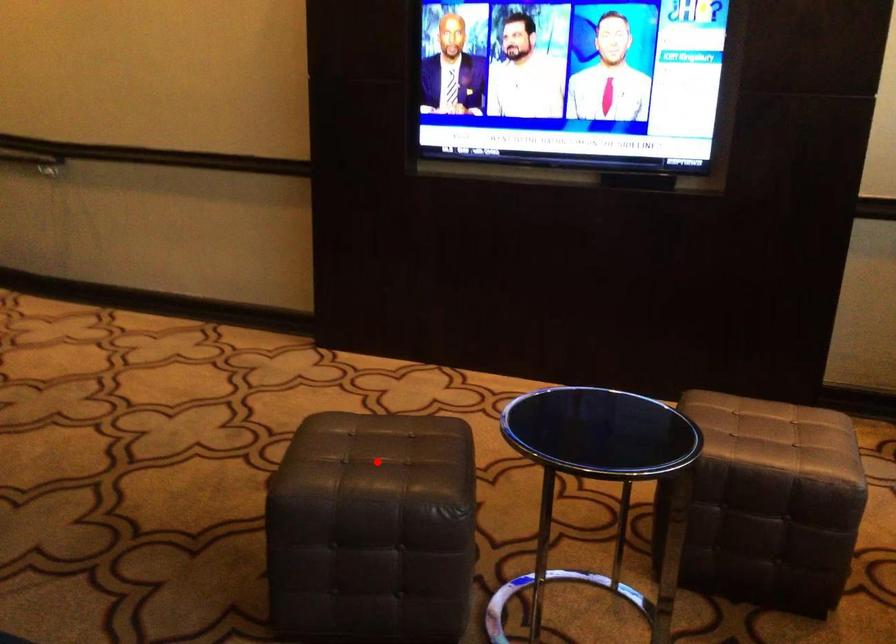
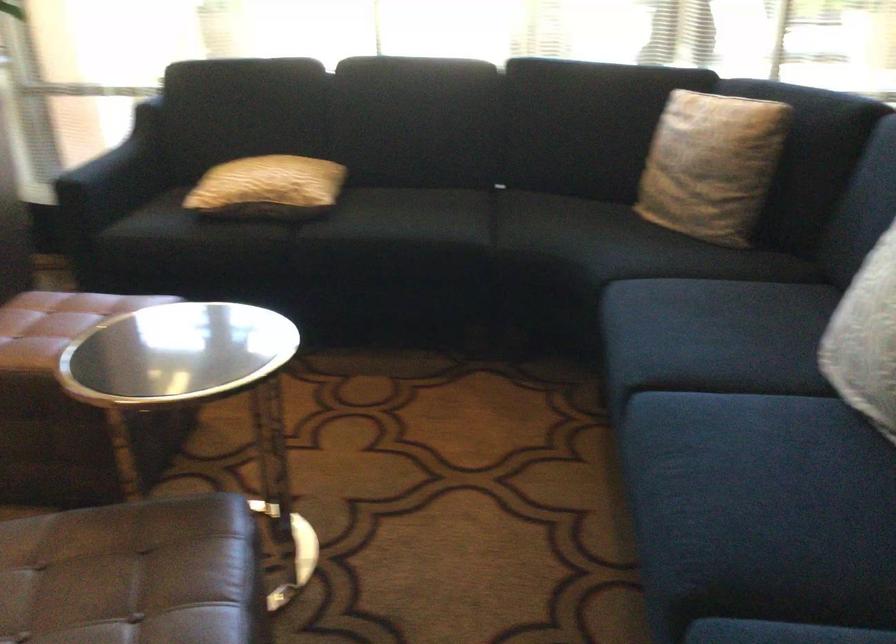
Where in the second image is the point corresponding to the highlighted location from the first image?

(134, 574)